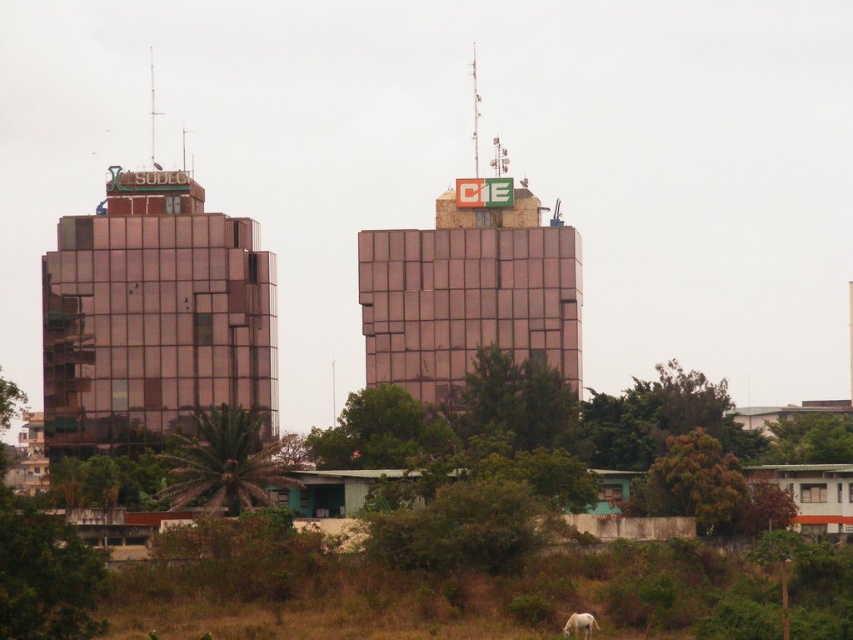
This screenshot has height=640, width=853. What do you see at coordinates (469, 291) in the screenshot?
I see `metallic glass building at center` at bounding box center [469, 291].

Does point (358, 262) lie behind point (578, 627)?

That is True.

The height and width of the screenshot is (640, 853). Describe the element at coordinates (469, 291) in the screenshot. I see `metallic glass building at center` at that location.

Identify the location of metallic glass building at center. (469, 291).

Which is below, matte glass building at left or white matte horse at lower right?

white matte horse at lower right is below.

Is point (271, 376) positioned before point (590, 614)?

No, it is not.

I want to click on matte glass building at left, so click(154, 317).

Is matte glass building at left to the right of metallic glass building at center from the viewer's perspective?

In fact, matte glass building at left is to the left of metallic glass building at center.

This screenshot has width=853, height=640. In order to click on matte glass building at left in this screenshot , I will do `click(154, 317)`.